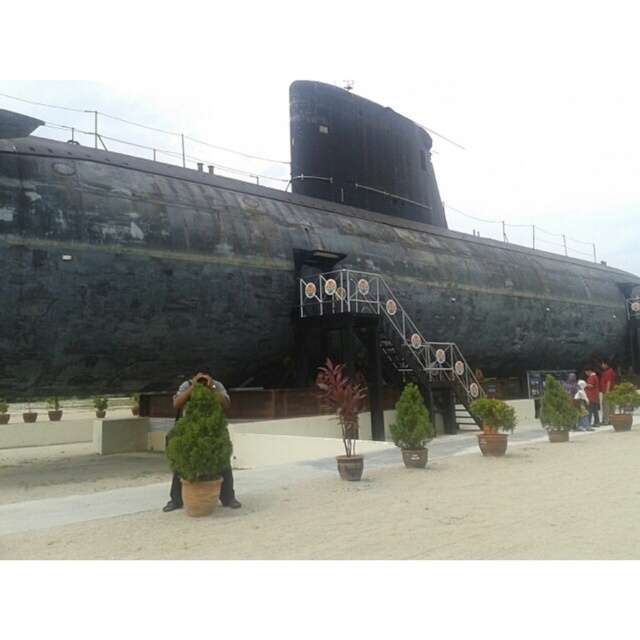
You are a tour guide explaining the submarine exhibit to a group. You notice a green leafy plant at center and a light brown fabric shirt at center in the foreground. Which object is wider?

The light brown fabric shirt at center is wider than the green leafy plant at center.